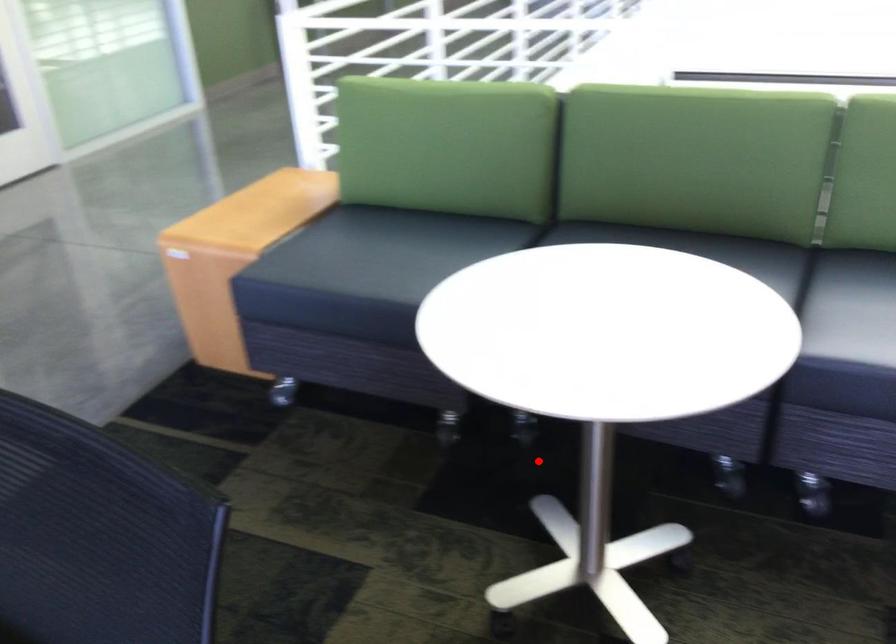
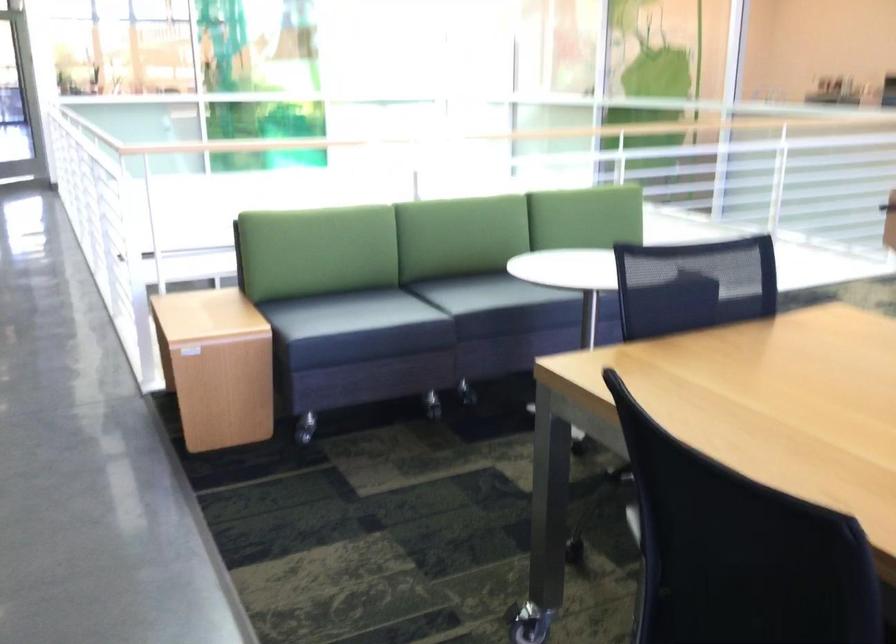
Question: I am providing you with two images of the same scene from different viewpoints. Image1 has a red point marked. In image2, the corresponding 3D location appears at what relative position? Reply with the corresponding letter.

Choices:
 (A) Closer
 (B) Farther

Answer: (B)